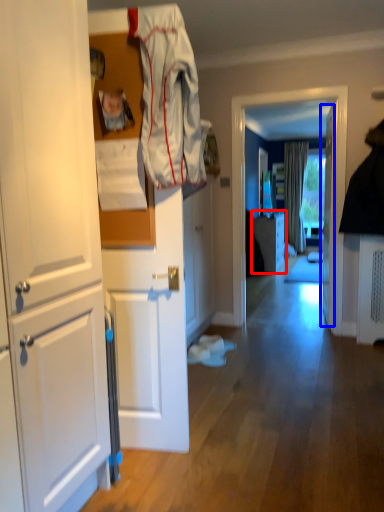
Question: Which point is further to the camera, cabinetry (highlighted by a red box) or door (highlighted by a blue box)?

Choices:
 (A) cabinetry
 (B) door

Answer: (A)